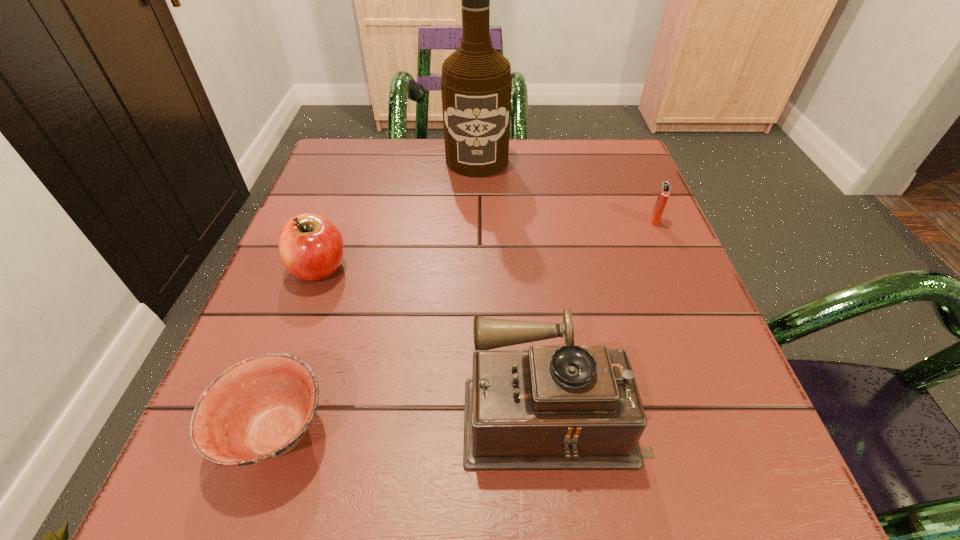
This screenshot has width=960, height=540. Find the location of `free spot between the farthest object and the phonograph_record`. free spot between the farthest object and the phonograph_record is located at coordinates (515, 283).

At what (x,y) coordinates should I click in order to perform the action: click on the closest object to the bowl. Please return your answer as a coordinate pair (x, y). The image size is (960, 540). Looking at the image, I should click on (553, 407).

Identify which object is the nearest to the tallest object. Please provide its 2D coordinates. Your answer should be formatted as a tuple, i.e. [(x, y)], where the tuple contains the x and y coordinates of a point satisfying the conditions above.

[(311, 247)]

I want to click on free space that satisfies the following two spatial constraints: 1. on the label of the rightmost object; 2. on the left side of the tallest object, so click(x=476, y=221).